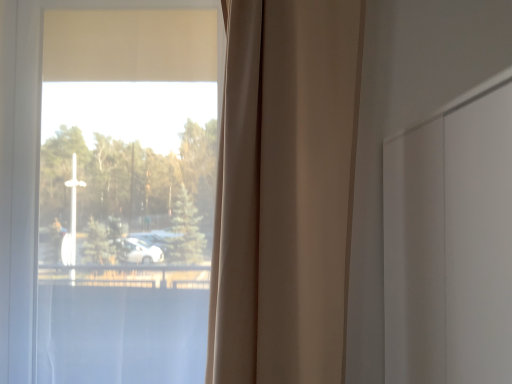
Question: Would you say beige fabric curtain at center is outside transparent glass window at center?

Choices:
 (A) no
 (B) yes

Answer: (B)

Question: Is transparent glass window at center surrounded by beige fabric curtain at center?

Choices:
 (A) yes
 (B) no

Answer: (B)

Question: Does beige fabric curtain at center have a lesser width compared to transparent glass window at center?

Choices:
 (A) yes
 (B) no

Answer: (A)

Question: Is beige fabric curtain at center further to the viewer compared to transparent glass window at center?

Choices:
 (A) no
 (B) yes

Answer: (A)

Question: Is beige fabric curtain at center aimed at transparent glass window at center?

Choices:
 (A) yes
 (B) no

Answer: (B)

Question: Considering the relative sizes of beige fabric curtain at center and transparent glass window at center in the image provided, is beige fabric curtain at center wider than transparent glass window at center?

Choices:
 (A) no
 (B) yes

Answer: (A)

Question: Is the surface of transparent glass window at center in direct contact with beige fabric curtain at center?

Choices:
 (A) no
 (B) yes

Answer: (A)

Question: Does transparent glass window at center have a lesser height compared to beige fabric curtain at center?

Choices:
 (A) no
 (B) yes

Answer: (A)

Question: Would you say transparent glass window at center contains beige fabric curtain at center?

Choices:
 (A) yes
 (B) no

Answer: (B)

Question: Is transparent glass window at center at the left side of beige fabric curtain at center?

Choices:
 (A) no
 (B) yes

Answer: (B)

Question: Is transparent glass window at center closer to camera compared to beige fabric curtain at center?

Choices:
 (A) no
 (B) yes

Answer: (A)

Question: Is transparent glass window at center to the right of beige fabric curtain at center from the viewer's perspective?

Choices:
 (A) yes
 (B) no

Answer: (B)

Question: Based on their positions, is beige fabric curtain at center located to the left or right of transparent glass window at center?

Choices:
 (A) right
 (B) left

Answer: (A)